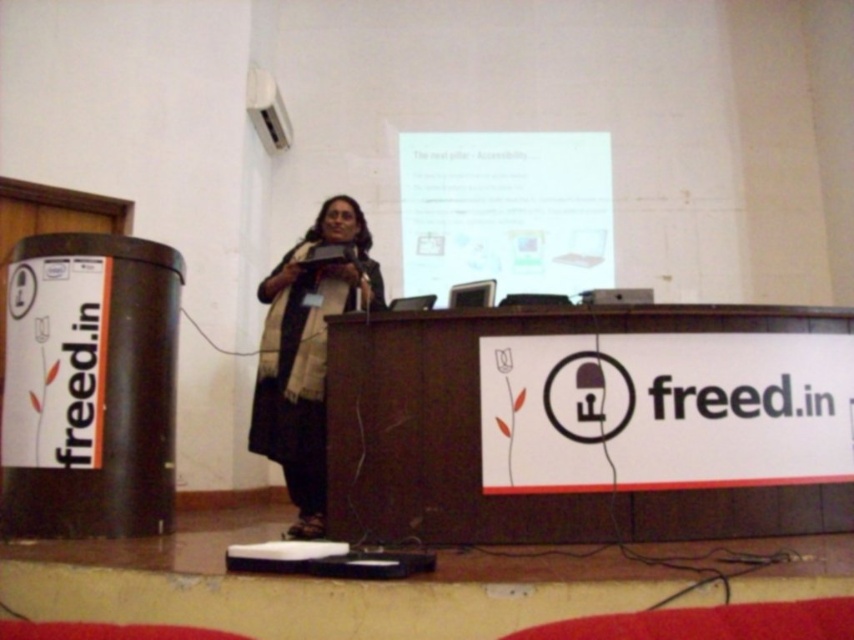
Can you confirm if white glossy projector screen at upper center is positioned to the right of dark gray scarf at center?

Yes, white glossy projector screen at upper center is to the right of dark gray scarf at center.

Does white glossy projector screen at upper center appear under dark gray scarf at center?

No.

In the scene shown: Measure the distance between point (x=483, y=269) and camera.

A distance of 5.65 meters exists between point (x=483, y=269) and camera.

Locate an element on the screen. The image size is (854, 640). white glossy projector screen at upper center is located at coordinates (506, 211).